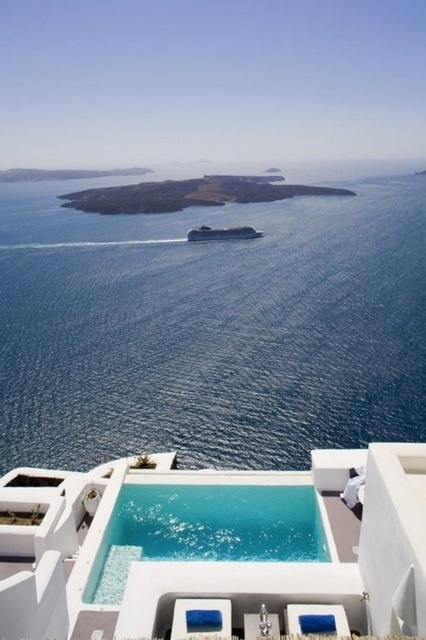
Question: Does white glossy pool at center appear under crystal clear glass pool at center?

Choices:
 (A) yes
 (B) no

Answer: (B)

Question: Is blue liquid water at center below gray rocky island at center?

Choices:
 (A) yes
 (B) no

Answer: (A)

Question: Among these objects, which one is farthest from the camera?

Choices:
 (A) white glossy pool at center
 (B) blue liquid water at center

Answer: (B)

Question: Does crystal clear glass pool at center have a smaller size compared to gray rocky island at center?

Choices:
 (A) yes
 (B) no

Answer: (A)

Question: Among these points, which one is farthest from the camera?

Choices:
 (A) (368, 486)
 (B) (115, 561)

Answer: (B)

Question: Which object is closer to the camera taking this photo?

Choices:
 (A) gray rocky island at center
 (B) crystal clear glass pool at center
 (C) blue liquid water at center

Answer: (B)